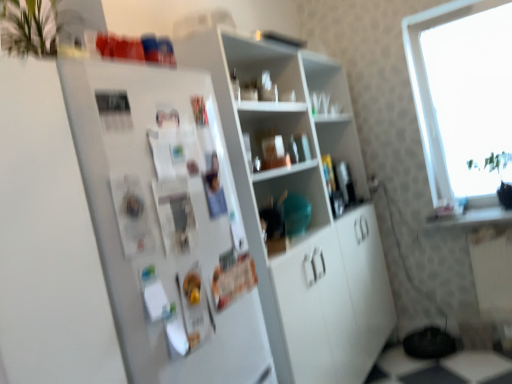
Question: Is matte plastic bowl at center, which appears as the 2th shelf when ordered from the bottom, thinner than white matte refrigerator at left?

Choices:
 (A) no
 (B) yes

Answer: (B)

Question: Is matte plastic bowl at center, which appears as the 2th shelf when ordered from the bottom, closer to the viewer compared to white matte refrigerator at left?

Choices:
 (A) yes
 (B) no

Answer: (B)

Question: Considering the relative positions of matte plastic bowl at center, which is the 2th shelf in top-to-bottom order, and white matte refrigerator at left in the image provided, is matte plastic bowl at center, which is the 2th shelf in top-to-bottom order, to the left of white matte refrigerator at left from the viewer's perspective?

Choices:
 (A) no
 (B) yes

Answer: (A)

Question: Does matte plastic bowl at center, which is the 2th shelf in top-to-bottom order, appear on the right side of white matte refrigerator at left?

Choices:
 (A) yes
 (B) no

Answer: (A)

Question: Is matte plastic bowl at center, which appears as the 2th shelf when ordered from the bottom, bigger than white matte refrigerator at left?

Choices:
 (A) no
 (B) yes

Answer: (A)

Question: Considering the relative sizes of matte plastic bowl at center, which is the 2th shelf in top-to-bottom order, and white matte refrigerator at left in the image provided, is matte plastic bowl at center, which is the 2th shelf in top-to-bottom order, taller than white matte refrigerator at left?

Choices:
 (A) yes
 (B) no

Answer: (B)

Question: Is matte plastic bowl at center, which appears as the 2th shelf when ordered from the bottom, further to camera compared to transparent glass window at upper right?

Choices:
 (A) yes
 (B) no

Answer: (B)

Question: Considering the relative positions of matte plastic bowl at center, which is the 2th shelf in top-to-bottom order, and transparent glass window at upper right in the image provided, is matte plastic bowl at center, which is the 2th shelf in top-to-bottom order, to the right of transparent glass window at upper right from the viewer's perspective?

Choices:
 (A) yes
 (B) no

Answer: (B)

Question: Is matte plastic bowl at center, which appears as the 2th shelf when ordered from the bottom, surrounding transparent glass window at upper right?

Choices:
 (A) no
 (B) yes

Answer: (A)

Question: Is matte plastic bowl at center, which appears as the 2th shelf when ordered from the bottom, beside transparent glass window at upper right?

Choices:
 (A) no
 (B) yes

Answer: (A)

Question: Could you tell me if matte plastic bowl at center, which appears as the 2th shelf when ordered from the bottom, is facing transparent glass window at upper right?

Choices:
 (A) yes
 (B) no

Answer: (B)

Question: Does matte plastic bowl at center, which appears as the 2th shelf when ordered from the bottom, have a greater width compared to transparent glass window at upper right?

Choices:
 (A) no
 (B) yes

Answer: (A)

Question: Would you consider white glossy cabinet at center, the first shelf ordered from the bottom, to be distant from white matte refrigerator at left?

Choices:
 (A) yes
 (B) no

Answer: (B)